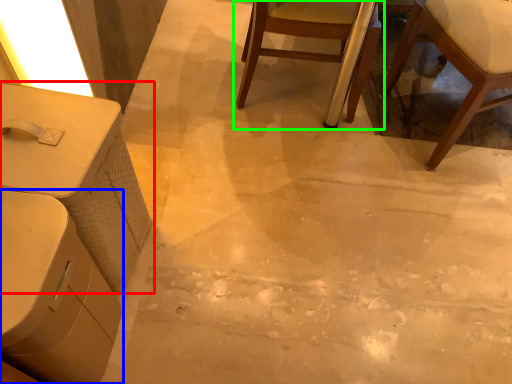
Question: Which is farther away from table (highlighted by a red box)? table (highlighted by a blue box) or chair (highlighted by a green box)?

Choices:
 (A) table
 (B) chair

Answer: (B)